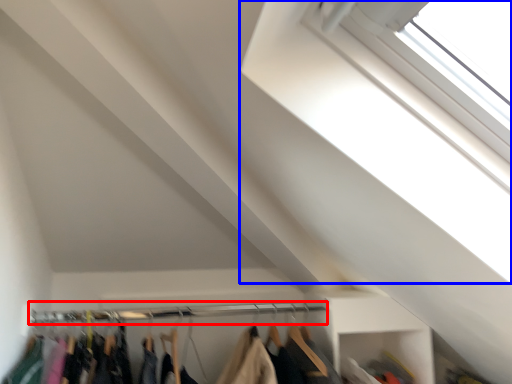
Question: Which of the following is the farthest to the observer, clothesline (highlighted by a red box) or window (highlighted by a blue box)?

Choices:
 (A) clothesline
 (B) window

Answer: (A)